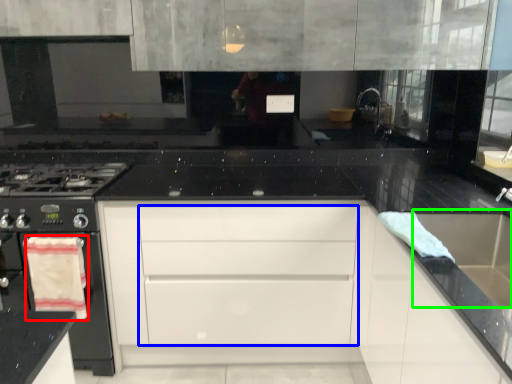
Question: Based on their relative distances, which object is farther from material (highlighted by a red box)? Choose from drawer (highlighted by a blue box) and sink (highlighted by a green box).

Choices:
 (A) drawer
 (B) sink

Answer: (B)